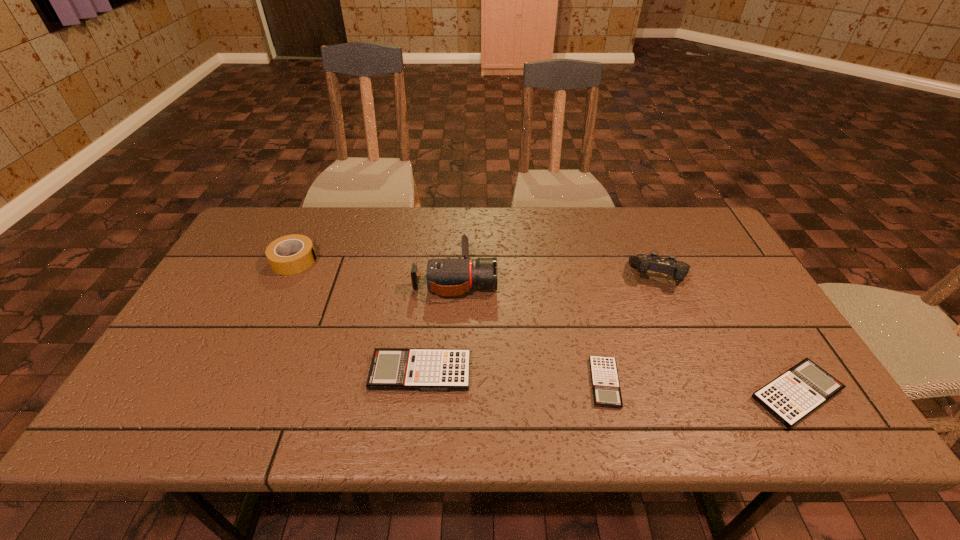
Where is `free point between the second tallest calculator and the fifth object from left to right`? free point between the second tallest calculator and the fifth object from left to right is located at coordinates (728, 335).

Where is `free space between the shortest object and the second tallest calculator`? The image size is (960, 540). free space between the shortest object and the second tallest calculator is located at coordinates (701, 388).

At what (x,y) coordinates should I click in order to perform the action: click on free space between the duct tape and the rightmost calculator. Please return your answer as a coordinate pair (x, y). Looking at the image, I should click on (546, 327).

The width and height of the screenshot is (960, 540). I want to click on vacant region between the camcorder and the leftmost calculator, so click(438, 325).

Identify which object is the fourth nearest to the rightmost calculator. Please provide its 2D coordinates. Your answer should be formatted as a tuple, i.e. [(x, y)], where the tuple contains the x and y coordinates of a point satisfying the conditions above.

[(391, 368)]

Identify which object is the fourth nearest to the leftmost calculator. Please provide its 2D coordinates. Your answer should be formatted as a tuple, i.e. [(x, y)], where the tuple contains the x and y coordinates of a point satisfying the conditions above.

[(652, 262)]

Identify which calculator is the second closest to the second calculator from right to left. Please provide its 2D coordinates. Your answer should be formatted as a tuple, i.e. [(x, y)], where the tuple contains the x and y coordinates of a point satisfying the conditions above.

[(792, 396)]

You are a GUI agent. You are given a task and a screenshot of the screen. Output one action in this format:
    pyautogui.click(x=<x>, y=<y>)
    Task: Click on the closest calculator to the fourth object from left to right
    Image resolution: width=960 pixels, height=540 pixels.
    Given the screenshot: What is the action you would take?
    pyautogui.click(x=391, y=368)

Where is `free space that satisfies the following two spatial constraints: 1. on the lens of the camcorder; 2. on the back side of the second shortest calculator`? free space that satisfies the following two spatial constraints: 1. on the lens of the camcorder; 2. on the back side of the second shortest calculator is located at coordinates (448, 394).

Find the location of `vacant space that satisfies the following two spatial constraints: 1. on the lens of the camcorder; 2. on the right side of the fourth object from left to right`. vacant space that satisfies the following two spatial constraints: 1. on the lens of the camcorder; 2. on the right side of the fourth object from left to right is located at coordinates (449, 383).